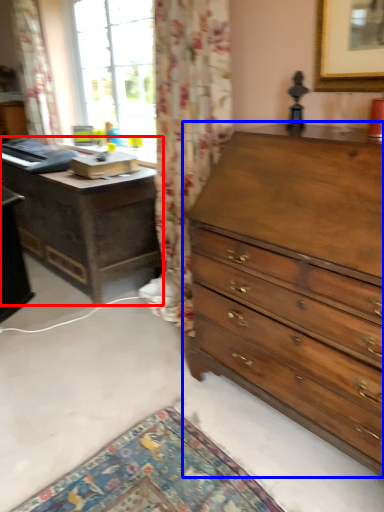
Question: Which object appears farthest to the camera in this image, nightstand (highlighted by a red box) or chest of drawers (highlighted by a blue box)?

Choices:
 (A) nightstand
 (B) chest of drawers

Answer: (A)